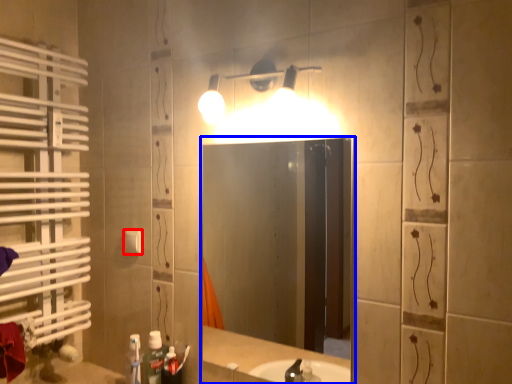
Question: Which object appears closest to the camera in this image, light switch (highlighted by a red box) or mirror (highlighted by a blue box)?

Choices:
 (A) light switch
 (B) mirror

Answer: (B)